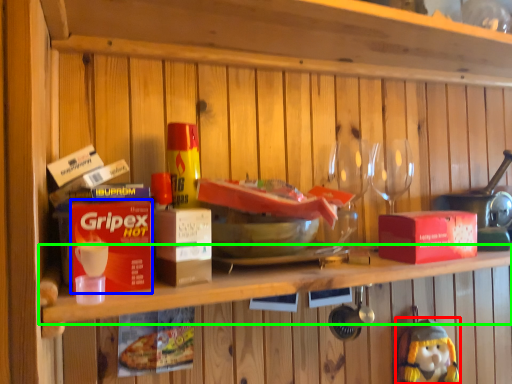
Question: Estimate the real-world distances between objects in this image. Which object is closer to figurine (highlighted by a red box), box (highlighted by a blue box) or shelf (highlighted by a green box)?

Choices:
 (A) box
 (B) shelf

Answer: (B)